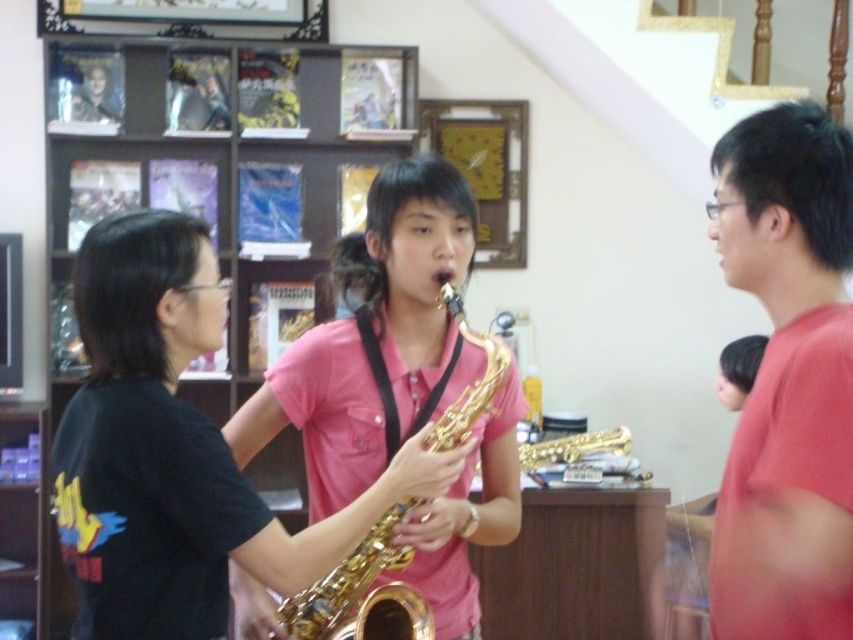
Question: Does gold shiny saxophone at center appear over matte red shirt at right?

Choices:
 (A) no
 (B) yes

Answer: (A)

Question: Which of the following is the farthest from the observer?

Choices:
 (A) (292, 630)
 (B) (410, 449)
 (C) (503, 145)

Answer: (C)

Question: Which object is positioned closest to the wooden frame at upper center?

Choices:
 (A) gold shiny trumpet at center
 (B) gold shiny saxophone at center
 (C) matte red shirt at right

Answer: (A)

Question: Can you confirm if matte red shirt at right is positioned to the right of wooden frame at upper center?

Choices:
 (A) no
 (B) yes

Answer: (B)

Question: Which object appears closest to the camera in this image?

Choices:
 (A) matte red shirt at right
 (B) wooden frame at upper center
 (C) gold shiny saxophone at center
 (D) gold shiny trumpet at center

Answer: (A)

Question: Considering the relative positions of gold shiny saxophone at center and gold shiny trumpet at center in the image provided, where is gold shiny saxophone at center located with respect to gold shiny trumpet at center?

Choices:
 (A) right
 (B) left

Answer: (B)